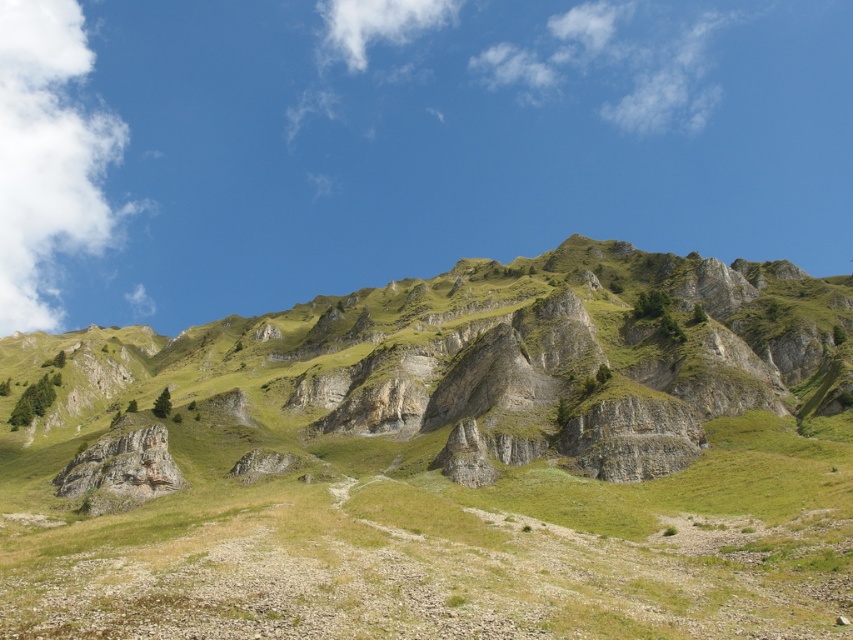
Question: Considering the real-world distances, which object is closest to the white fluffy cloud at upper left?

Choices:
 (A) green grassy mountain at upper center
 (B) white fluffy cloud at upper center

Answer: (B)

Question: Is green grassy mountain at upper center thinner than white fluffy cloud at upper center?

Choices:
 (A) no
 (B) yes

Answer: (A)

Question: Is white fluffy cloud at upper left to the left of white fluffy cloud at upper center from the viewer's perspective?

Choices:
 (A) no
 (B) yes

Answer: (B)

Question: Is green grassy mountain at upper center further to camera compared to white fluffy cloud at upper left?

Choices:
 (A) yes
 (B) no

Answer: (B)

Question: Which of the following is the closest to the observer?

Choices:
 (A) (9, 100)
 (B) (412, 3)

Answer: (B)

Question: Considering the real-world distances, which object is farthest from the white fluffy cloud at upper left?

Choices:
 (A) white fluffy cloud at upper center
 (B) green grassy mountain at upper center

Answer: (B)